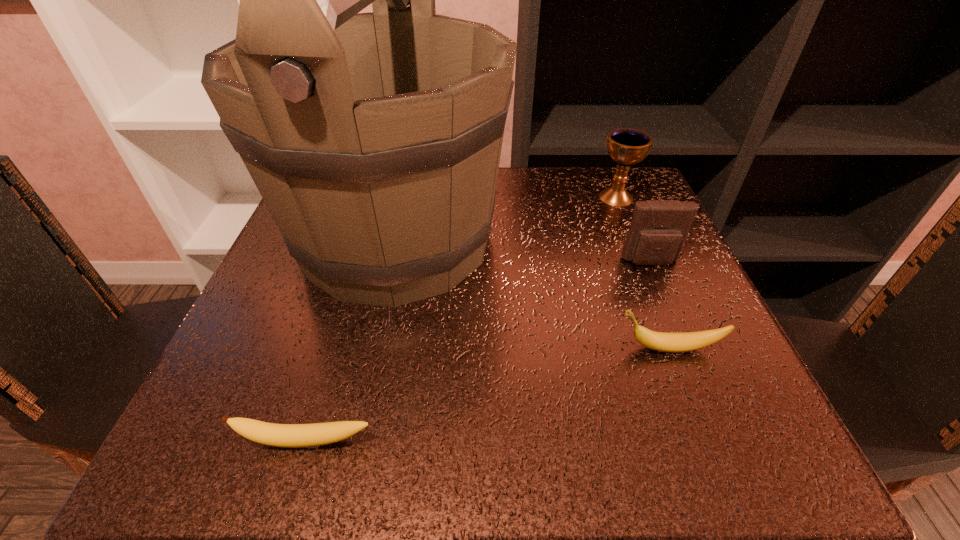
Where is `banana located at the right edge`? This screenshot has height=540, width=960. banana located at the right edge is located at coordinates (661, 341).

Locate an element on the screen. Image resolution: width=960 pixels, height=540 pixels. object at the far left corner is located at coordinates (374, 139).

Where is `object positioned at the near left corner`? The image size is (960, 540). object positioned at the near left corner is located at coordinates (279, 435).

The height and width of the screenshot is (540, 960). Identify the location of object that is at the far right corner. (626, 146).

Identify the location of blank area at the far edge. (516, 221).

This screenshot has width=960, height=540. Identify the location of vacant space at the left edge. (297, 277).

At what (x,y) coordinates should I click in order to perform the action: click on free space at the right edge of the desktop. Please return your answer as a coordinate pair (x, y). This screenshot has height=540, width=960. Looking at the image, I should click on (657, 270).

At what (x,y) coordinates should I click in order to perform the action: click on free point at the far right corner. Please return your answer as a coordinate pair (x, y). The image size is (960, 540). Looking at the image, I should click on (594, 175).

In order to click on unoccupied area between the shortest object and the taller banana in this screenshot , I will do `click(488, 395)`.

You are a GUI agent. You are given a task and a screenshot of the screen. Output one action in this format:
    pyautogui.click(x=<x>, y=<y>)
    Task: Click on the free spot between the second nearest object and the left banana
    
    Given the screenshot: What is the action you would take?
    pyautogui.click(x=488, y=395)